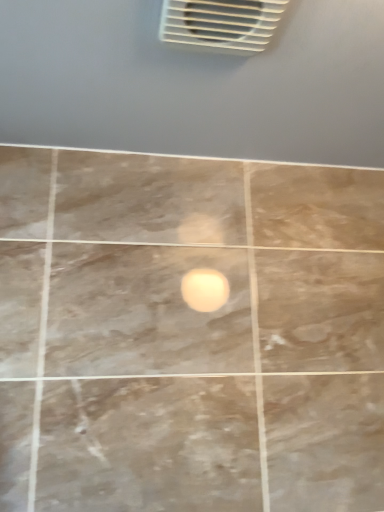
Describe the element at coordinates (220, 24) in the screenshot. Image resolution: width=384 pixels, height=512 pixels. I see `white plastic vent at upper center` at that location.

This screenshot has width=384, height=512. What are the coordinates of `white plastic vent at upper center` in the screenshot? It's located at (220, 24).

Where is `white plastic vent at upper center`? white plastic vent at upper center is located at coordinates (220, 24).